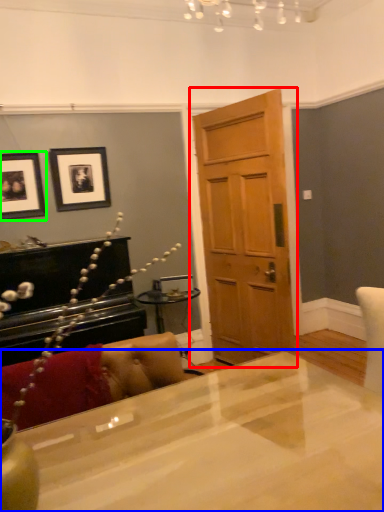
Question: Which is farther away from door (highlighted by a red box)? desk (highlighted by a blue box) or picture frame (highlighted by a green box)?

Choices:
 (A) desk
 (B) picture frame

Answer: (A)